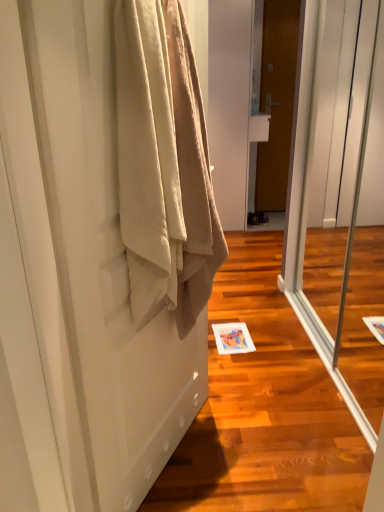
Locate an element on the screen. Image resolution: width=384 pixels, height=512 pixels. vacant space positioned to the left of transparent glass screen door at center is located at coordinates (268, 365).